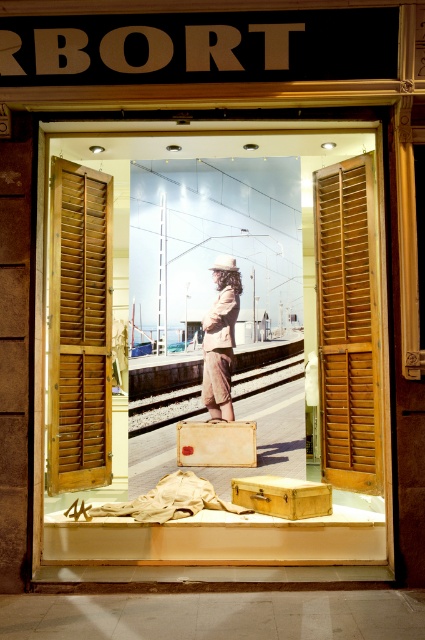
Question: Which object is closer to the camera taking this photo?

Choices:
 (A) wooden briefcase at center
 (B) beige leather briefcase at center
 (C) wooden shutters at left

Answer: (A)

Question: Does metallic train track at center have a smaller size compared to beige leather briefcase at center?

Choices:
 (A) yes
 (B) no

Answer: (A)

Question: Among these points, which one is nearest to the camera?

Choices:
 (A) (164, 413)
 (B) (317, 486)
 (C) (214, 294)

Answer: (B)

Question: Which object appears closest to the camera in this image?

Choices:
 (A) beige leather briefcase at center
 (B) light brown fabric coat at center
 (C) wooden shutters at left
 (D) wooden at right

Answer: (D)

Question: Does metallic train track at center have a greater width compared to wooden briefcase at center?

Choices:
 (A) no
 (B) yes

Answer: (A)

Question: Is wooden at right bigger than light brown fabric coat at center?

Choices:
 (A) no
 (B) yes

Answer: (B)